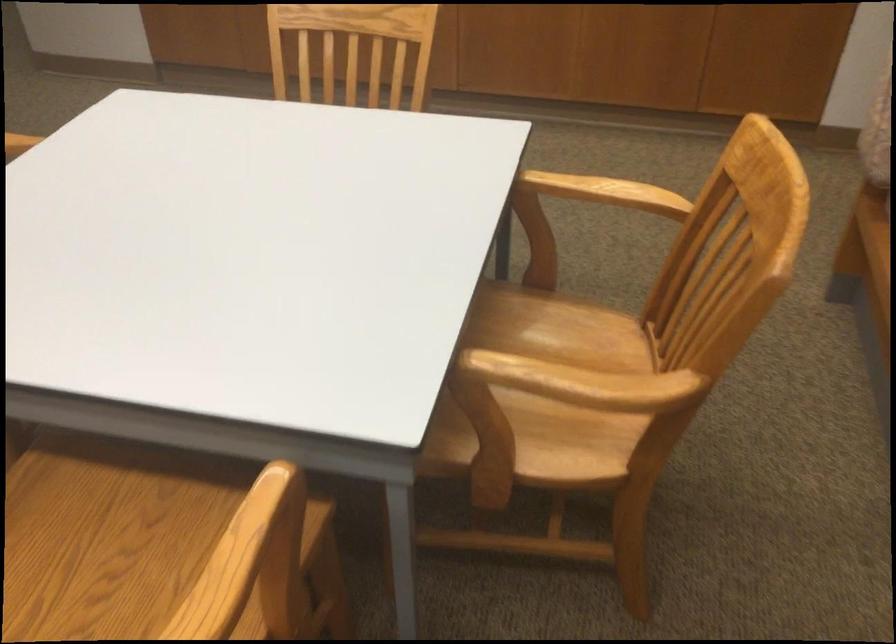
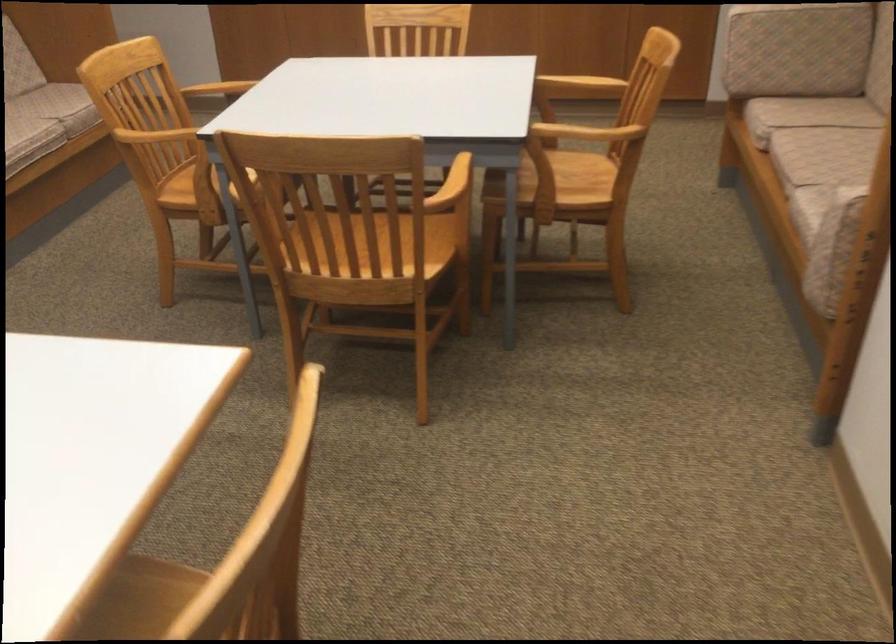
Find the pixel in the second image that matches the point at 521,451 in the first image.

(556, 182)